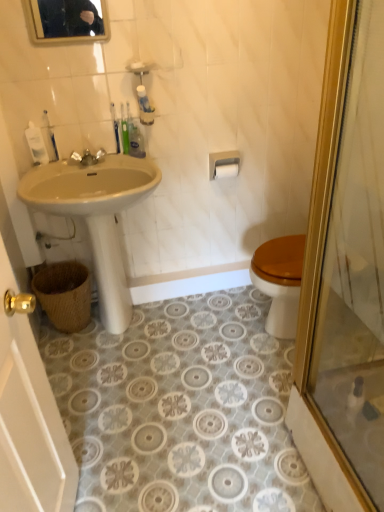
Where is `vacant area that lies between matte silver faucet at upper center and white plastic toothpaste tube at upper left, which appears as the 2th toiletry when viewed from the left`? Image resolution: width=384 pixels, height=512 pixels. vacant area that lies between matte silver faucet at upper center and white plastic toothpaste tube at upper left, which appears as the 2th toiletry when viewed from the left is located at coordinates (69, 164).